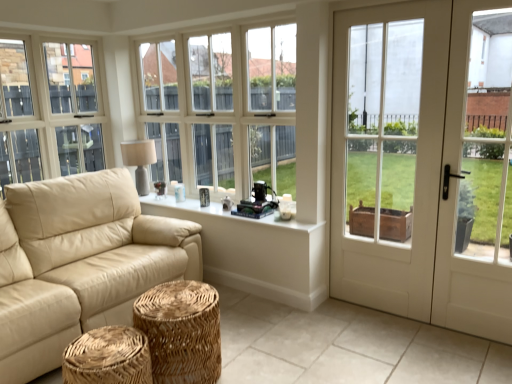
You are a GUI agent. You are given a task and a screenshot of the screen. Output one action in this format:
    pyautogui.click(x=<x>, y=<y>)
    Task: Click on the free space above woven natural stool at lower center, which ranks as the 2th stool in back-to-front order (from a real-world perspective)
    Image resolution: width=512 pixels, height=384 pixels.
    Given the screenshot: What is the action you would take?
    pyautogui.click(x=104, y=345)